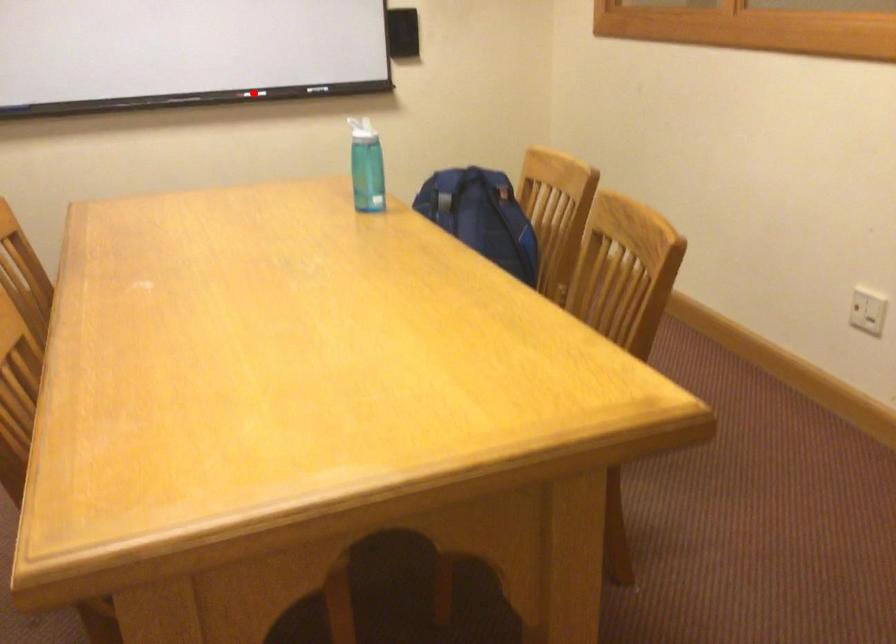
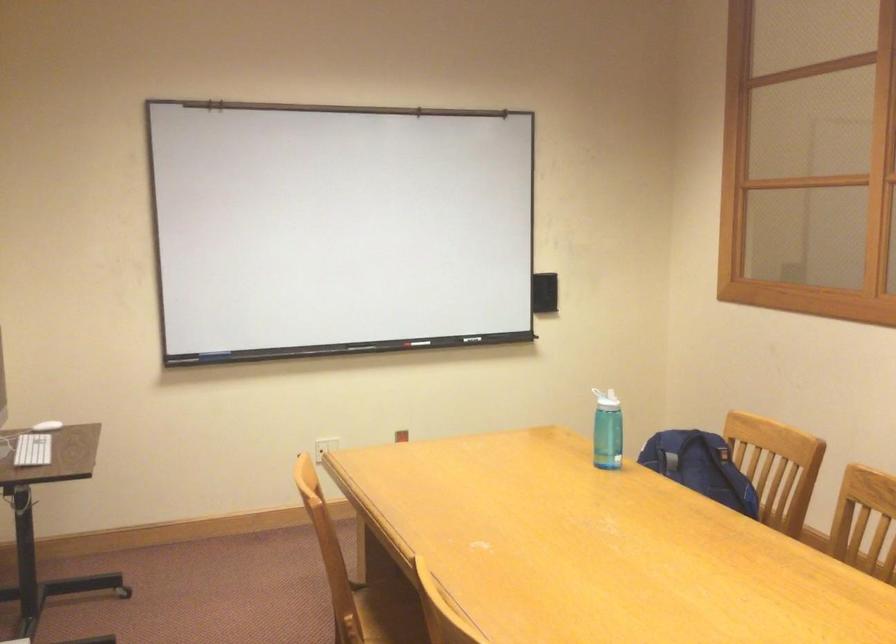
Question: I am providing you with two images of the same scene from different viewpoints. Image1 has a red point marked. In image2, the corresponding 3D location appears at what relative position? Reply with the corresponding letter.

Choices:
 (A) Closer
 (B) Farther

Answer: (B)